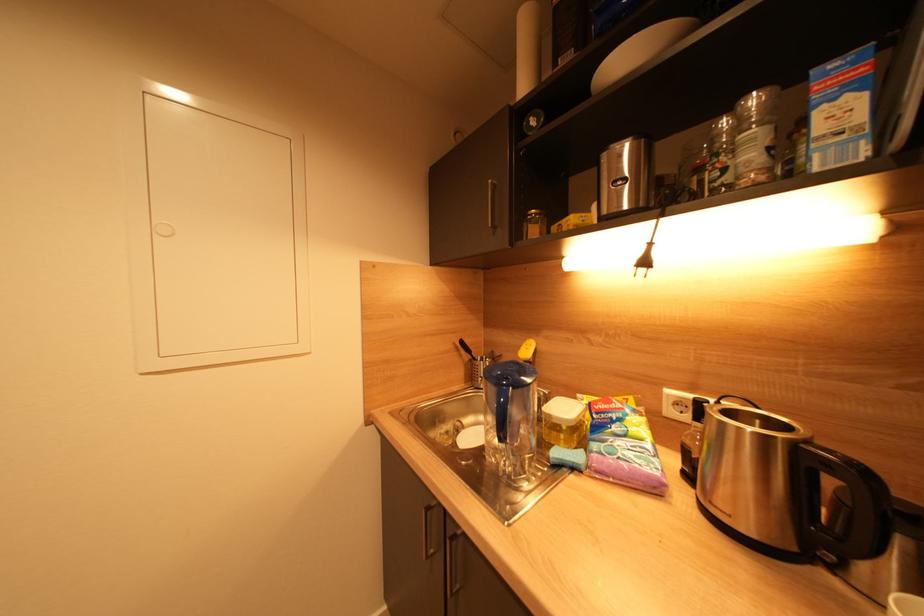
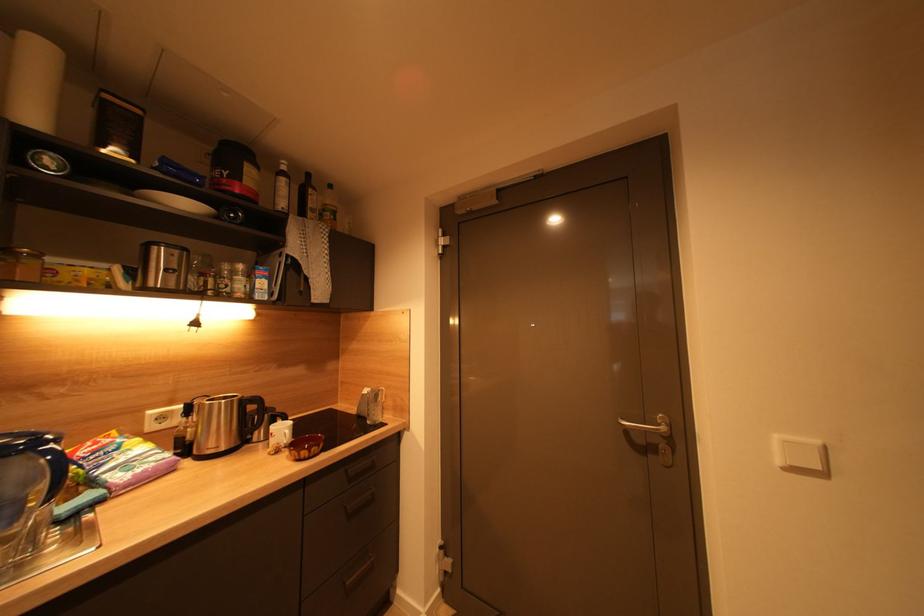
Question: The camera is either moving clockwise (left) or counter-clockwise (right) around the object. The first image is from the beginning of the video and the second image is from the end. Is the camera moving left or right when shooting the video?

Choices:
 (A) Left
 (B) Right

Answer: (A)